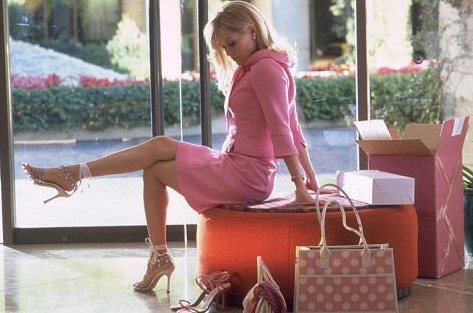
Identify the location of box. The image size is (473, 313). (440, 182).